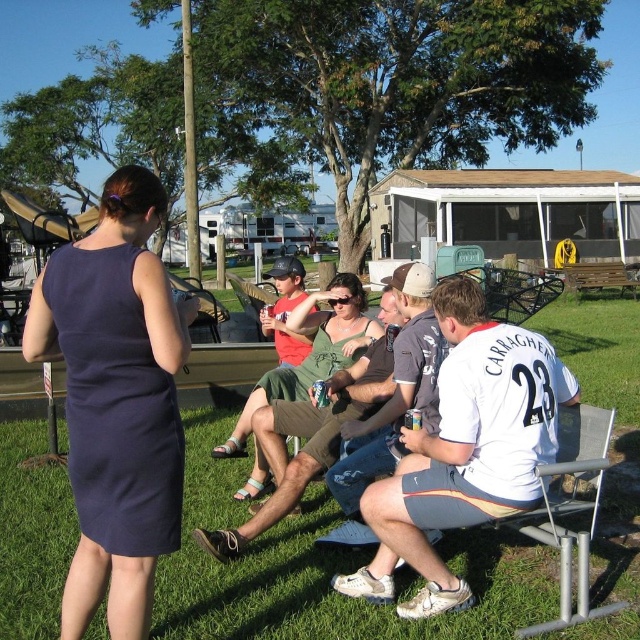
Question: Which of the following is the closest to the observer?

Choices:
 (A) green grass at center
 (B) navy blue fabric dress at left
 (C) dark gray cotton t-shirt at center
 (D) white jersey at center

Answer: (B)

Question: Which point appears farthest from the camera in this image?

Choices:
 (A) (422, 317)
 (B) (595, 584)

Answer: (A)

Question: Does navy blue fabric dress at left have a smaller size compared to green fabric dress at center?

Choices:
 (A) yes
 (B) no

Answer: (A)

Question: Which of the following is the closest to the observer?

Choices:
 (A) dark gray cotton t-shirt at center
 (B) white jersey at center
 (C) navy blue fabric dress at left
 (D) green grass at center

Answer: (C)

Question: Is green grass at center to the left of green fabric dress at center from the viewer's perspective?

Choices:
 (A) yes
 (B) no

Answer: (B)

Question: Can you confirm if green grass at center is smaller than dark gray cotton t-shirt at center?

Choices:
 (A) no
 (B) yes

Answer: (A)